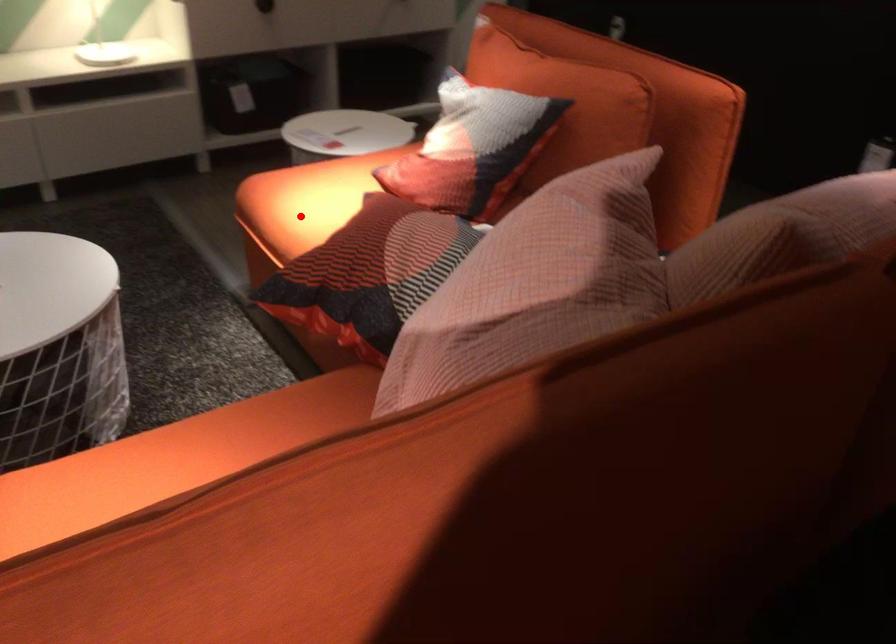
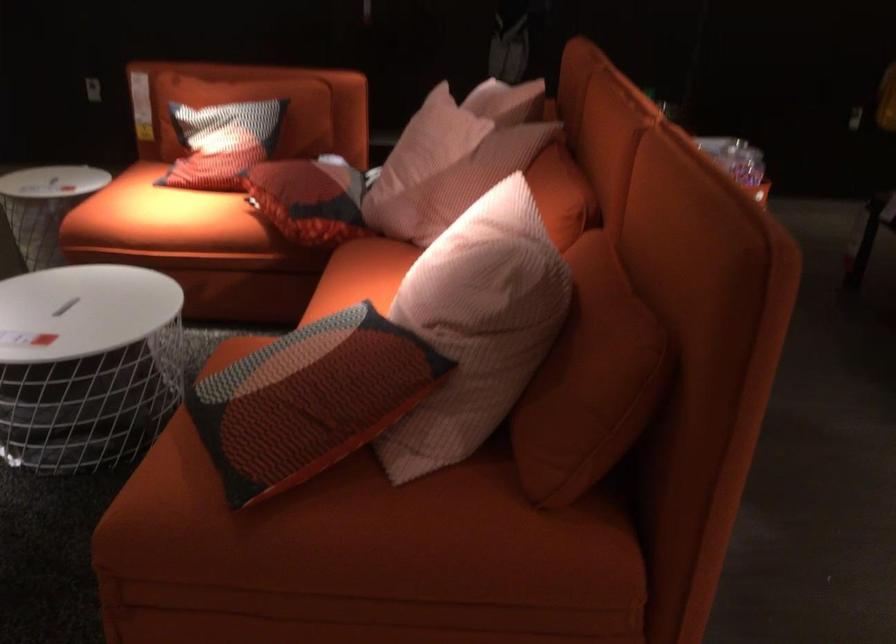
Question: I am providing you with two images of the same scene from different viewpoints. In image1, a red point is highlighted. Considering the same 3D point in image2, which of the following is correct?

Choices:
 (A) It is closer
 (B) It is farther

Answer: (B)